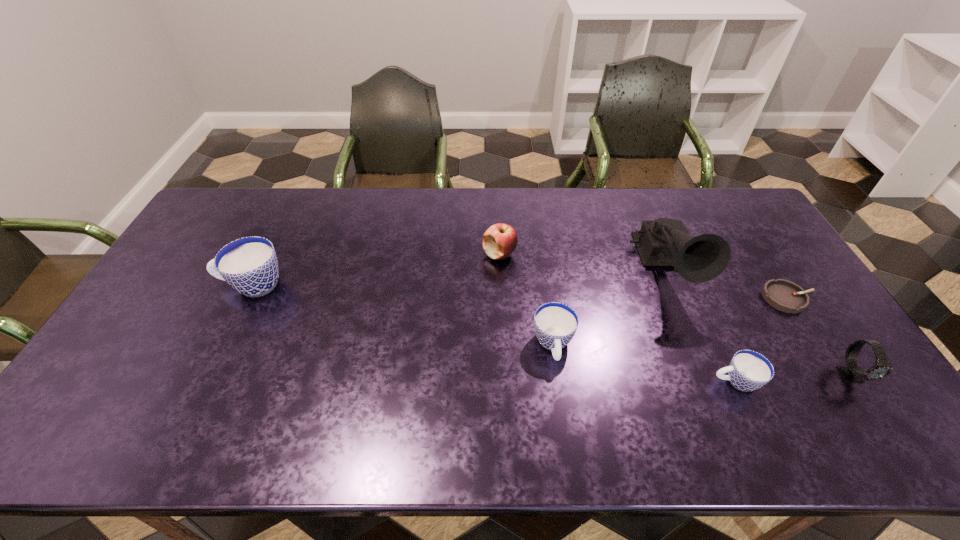
Image resolution: width=960 pixels, height=540 pixels. What are the coordinates of `free space that is in between the watch and the sixth object from right to left` in the screenshot? It's located at (676, 314).

Image resolution: width=960 pixels, height=540 pixels. I want to click on object that is the fifth closest to the second shortest object, so click(x=500, y=240).

Identify the location of object that stands as the second closest to the sixth tallest object. (851, 373).

Locate which cup is the second closest to the third shortest object. Please provide its 2D coordinates. Your answer should be formatted as a tuple, i.e. [(x, y)], where the tuple contains the x and y coordinates of a point satisfying the conditions above.

[(249, 264)]

The image size is (960, 540). I want to click on the closest cup to the third object from left to right, so tap(748, 370).

I want to click on vacant space that satisfies the following two spatial constraints: 1. from the horn of the shortest object; 2. on the right side of the phonograph_record, so click(677, 298).